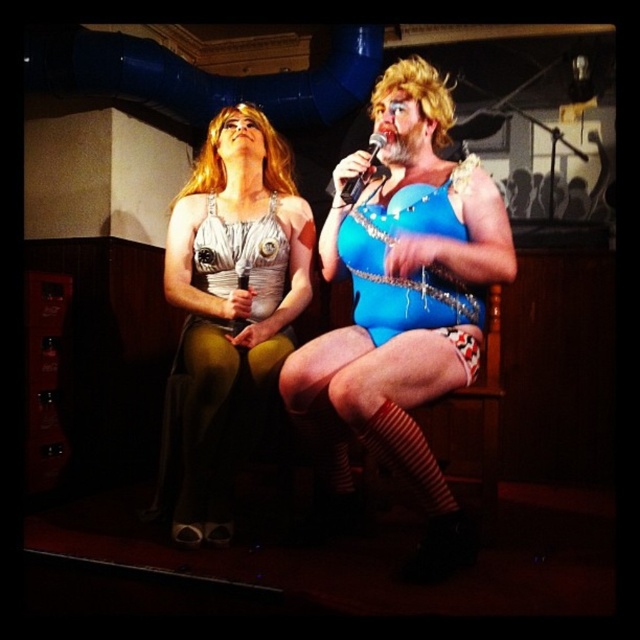
Does point (403, 362) come closer to viewer compared to point (268, 394)?

Yes, point (403, 362) is closer to viewer.

Can you confirm if blue shiny bodysuit at center is positioned below yellow spandex tights at center?

Incorrect, blue shiny bodysuit at center is not positioned below yellow spandex tights at center.

At what (x,y) coordinates should I click in order to perform the action: click on blue shiny bodysuit at center. Please return your answer as a coordinate pair (x, y). This screenshot has width=640, height=640. Looking at the image, I should click on (403, 304).

What are the coordinates of `blue shiny bodysuit at center` in the screenshot? It's located at (403, 304).

Identify the location of white dotted fabric at lower center. (464, 348).

This screenshot has width=640, height=640. In order to click on white dotted fabric at lower center in this screenshot , I will do `click(464, 348)`.

Image resolution: width=640 pixels, height=640 pixels. Describe the element at coordinates (212, 422) in the screenshot. I see `yellow spandex tights at center` at that location.

Does point (209, 404) come in front of point (451, 333)?

No.

Locate an element on the screen. The image size is (640, 640). yellow spandex tights at center is located at coordinates (212, 422).